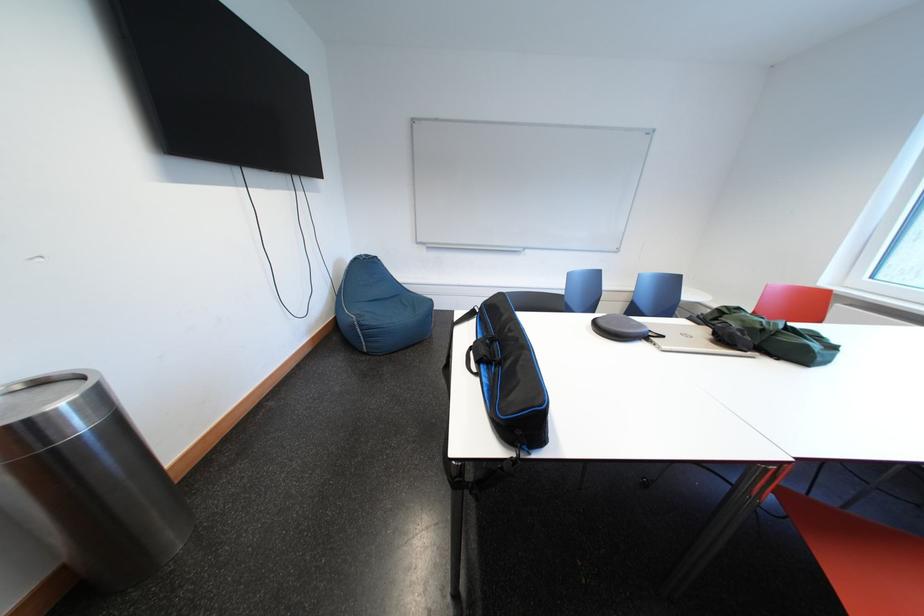
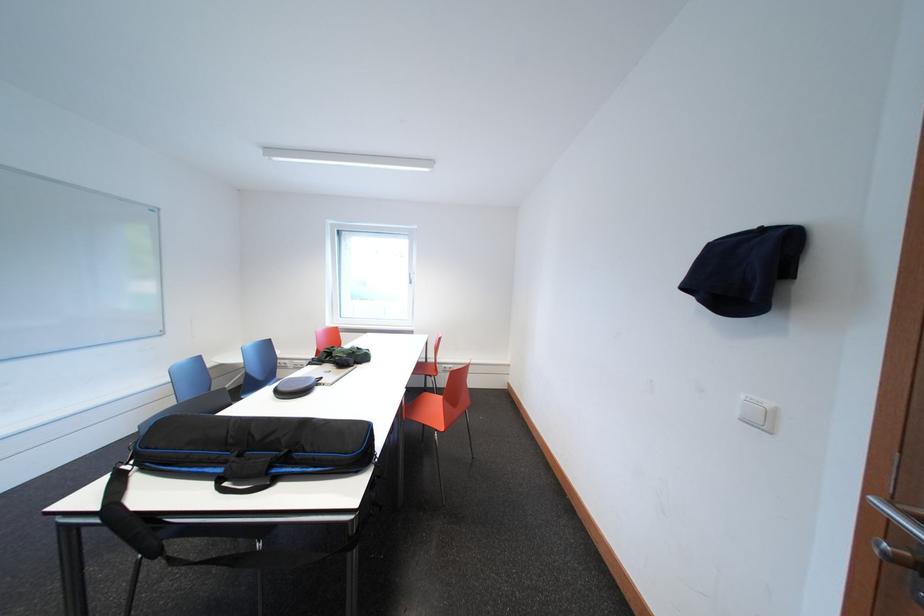
Question: How did the camera likely rotate?

Choices:
 (A) Left
 (B) Right
 (C) Up
 (D) Down

Answer: (B)